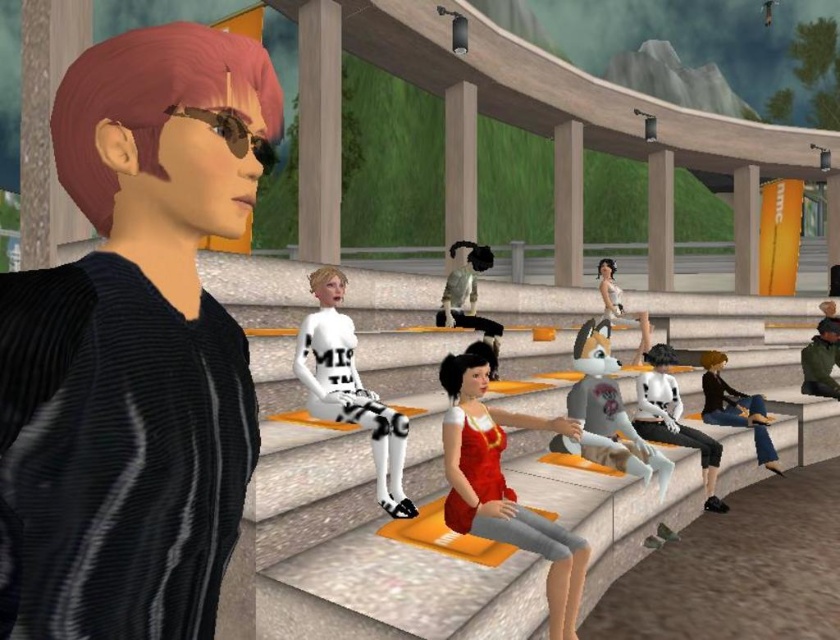
Question: Can you confirm if gray fabric dog at center is smaller than matte white dress at center?

Choices:
 (A) no
 (B) yes

Answer: (B)

Question: From the image, what is the correct spatial relationship of white matte/soft fabric at center in relation to matte white dress at center?

Choices:
 (A) above
 (B) below

Answer: (B)

Question: Which point is closer to the camera?

Choices:
 (A) white matte/soft fabric at center
 (B) matte black sweater at left

Answer: (B)

Question: Among these objects, which one is nearest to the camera?

Choices:
 (A) white matte/soft fabric at center
 (B) matte black sweater at left
 (C) gray fabric dog at center
 (D) black leather jacket at lower right

Answer: (B)

Question: Does shiny red dress at center come in front of black leather jacket at lower right?

Choices:
 (A) yes
 (B) no

Answer: (A)

Question: Which of the following is the closest to the observer?

Choices:
 (A) (453, 324)
 (B) (562, 602)
 (C) (96, 298)
 (D) (333, 362)

Answer: (C)